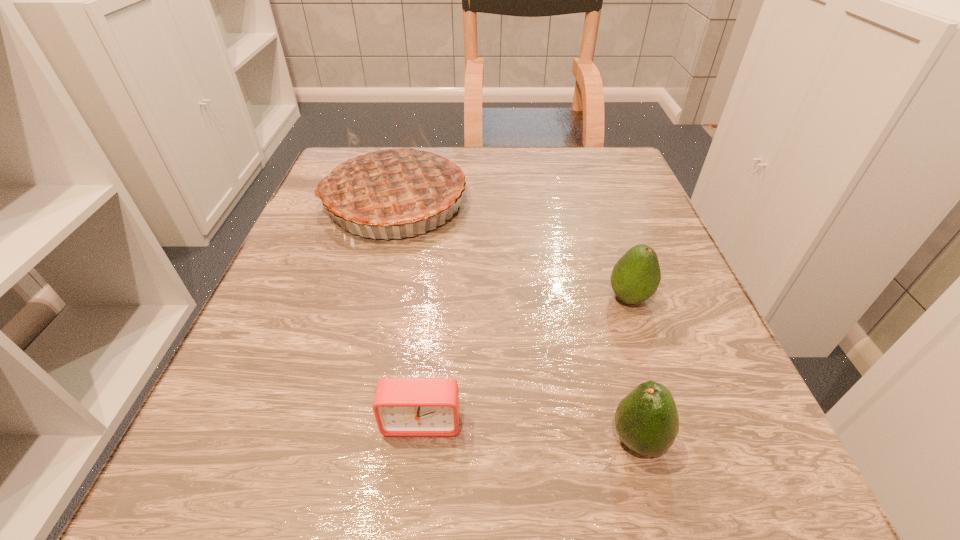
Point out which object is positioned as the nearest to the nearer avocado. Please provide its 2D coordinates. Your answer should be formatted as a tuple, i.e. [(x, y)], where the tuple contains the x and y coordinates of a point satisfying the conditions above.

[(635, 277)]

The height and width of the screenshot is (540, 960). Find the location of `vacant position in the image that satisfies the following two spatial constraints: 1. on the back side of the second farthest object; 2. on the right side of the nearer avocado`. vacant position in the image that satisfies the following two spatial constraints: 1. on the back side of the second farthest object; 2. on the right side of the nearer avocado is located at coordinates (598, 298).

Locate an element on the screen. This screenshot has width=960, height=540. free space that satisfies the following two spatial constraints: 1. on the front-facing side of the nearer avocado; 2. on the left side of the shortest object is located at coordinates (420, 440).

Identify the location of free space that satisfies the following two spatial constraints: 1. on the front-facing side of the shortest object; 2. on the left side of the nearer avocado. (420, 440).

This screenshot has width=960, height=540. Find the location of `vacant space that satisfies the following two spatial constraints: 1. on the front side of the nearer avocado; 2. on the left side of the farthest object`. vacant space that satisfies the following two spatial constraints: 1. on the front side of the nearer avocado; 2. on the left side of the farthest object is located at coordinates (334, 440).